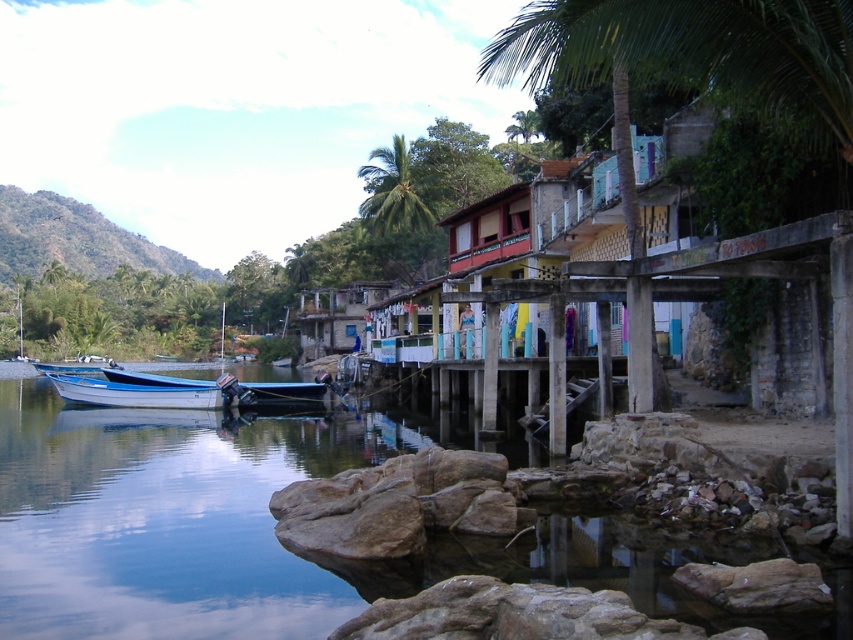
From the picture: Is green leafy palm tree at center taller than white glossy boat at lower left?

Yes.

Can you confirm if green leafy palm tree at center is positioned to the left of white glossy boat at lower left?

No, green leafy palm tree at center is not to the left of white glossy boat at lower left.

Is point (380, 209) positioned after point (91, 401)?

Yes.

The height and width of the screenshot is (640, 853). In order to click on green leafy palm tree at center in this screenshot , I will do `click(393, 192)`.

In the scene shown: Does blue glossy water at lower left lie behind blue matte boat at left?

No, it is in front of blue matte boat at left.

The image size is (853, 640). What do you see at coordinates (242, 525) in the screenshot? I see `blue glossy water at lower left` at bounding box center [242, 525].

Locate an element on the screen. The width and height of the screenshot is (853, 640). blue glossy water at lower left is located at coordinates (242, 525).

Based on the photo, who is more forward, (x=112, y=499) or (x=387, y=221)?

Point (x=112, y=499) is in front.

Is blue glossy water at lower left wider than green leafy palm tree at center?

Correct, the width of blue glossy water at lower left exceeds that of green leafy palm tree at center.

You are a GUI agent. You are given a task and a screenshot of the screen. Output one action in this format:
    pyautogui.click(x=<x>, y=<y>)
    Task: Click on the blue glossy water at lower left
    Image resolution: width=853 pixels, height=640 pixels.
    Given the screenshot: What is the action you would take?
    pyautogui.click(x=242, y=525)

Identify the location of blue glossy water at lower left. Image resolution: width=853 pixels, height=640 pixels. (242, 525).